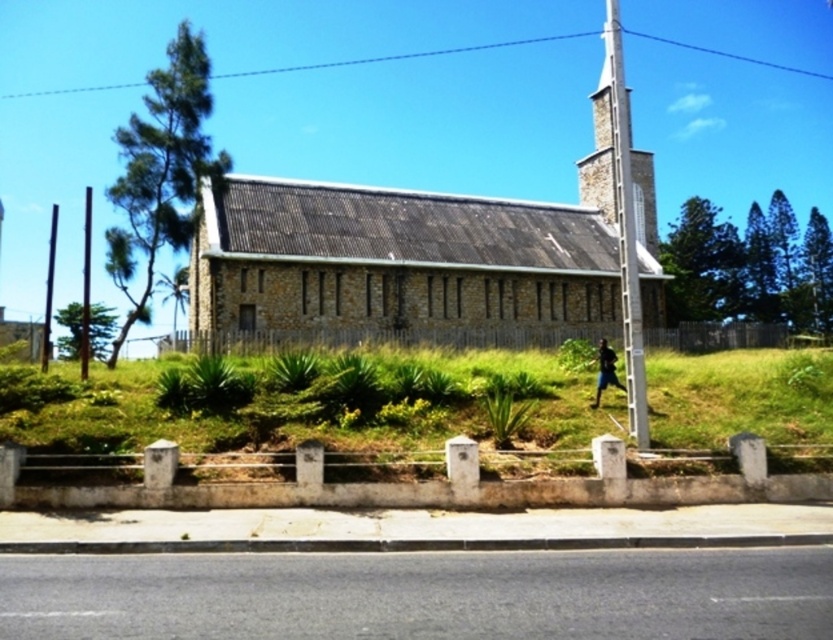
Question: Among these objects, which one is nearest to the camera?

Choices:
 (A) stone steeple at upper center
 (B) gray concrete curb at lower center
 (C) dark blue fabric at right
 (D) brown stone church at center

Answer: (B)

Question: Is gray concrete curb at lower center closer to camera compared to stone steeple at upper center?

Choices:
 (A) yes
 (B) no

Answer: (A)

Question: Where is stone steeple at upper center located in relation to dark blue fabric at right in the image?

Choices:
 (A) right
 (B) left

Answer: (A)

Question: Which object appears closest to the camera in this image?

Choices:
 (A) brown stone church at center
 (B) gray concrete curb at lower center
 (C) dark blue fabric at right

Answer: (B)

Question: Which point appears closest to the camera in this image?

Choices:
 (A) (592, 122)
 (B) (413, 244)
 (C) (599, 384)

Answer: (C)

Question: Is brown stone church at center thinner than gray concrete curb at lower center?

Choices:
 (A) no
 (B) yes

Answer: (A)